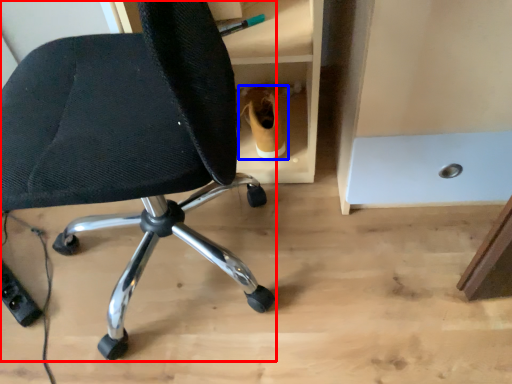
Question: Which point is further to the camera, chair (highlighted by a red box) or footwear (highlighted by a blue box)?

Choices:
 (A) chair
 (B) footwear

Answer: (B)